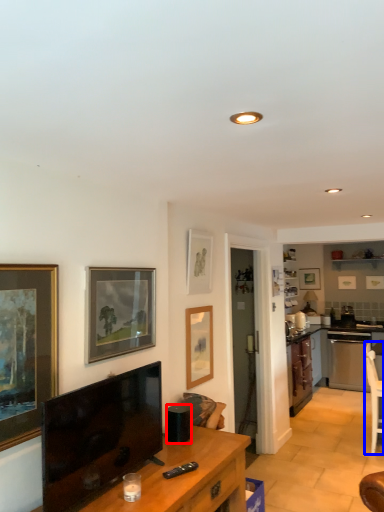
Question: Which point is further to the camera, appliance (highlighted by a red box) or chair (highlighted by a blue box)?

Choices:
 (A) appliance
 (B) chair

Answer: (B)